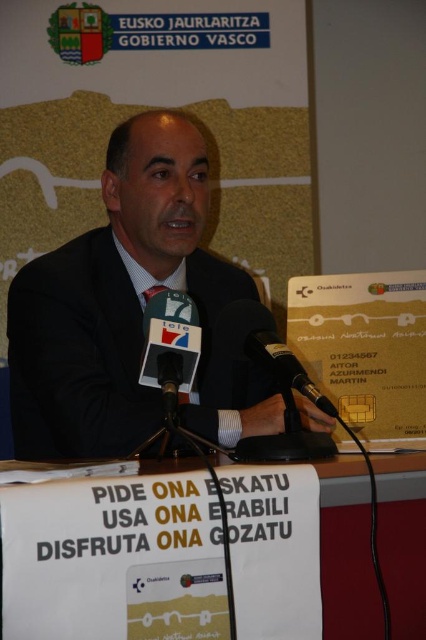
You are an attendee at the press conference. You notice the white paper at lower center and the black matte suit at center. Which object is positioned lower in the image?

The white paper at lower center is positioned below the black matte suit at center, so it is lower in the image.

You are a photographer at the event and need to focus on two points in the image. One is the man at point (189, 472) and the other is the podium at point (57, 428). Which point should you focus on first to ensure the subject is sharp?

Point (189, 472) is closer to the camera than point (57, 428), so focusing on the man at point (189, 472) first will ensure the subject is sharp.